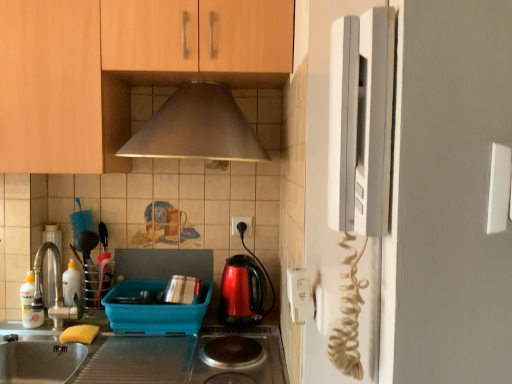
Where is `shiny plastic kettle at center`? The width and height of the screenshot is (512, 384). shiny plastic kettle at center is located at coordinates point(242,290).

This screenshot has height=384, width=512. Describe the element at coordinates (120, 69) in the screenshot. I see `wooden cabinet at upper center` at that location.

Identify the location of metallic silver exhaust hood at upper center. The image size is (512, 384). (197, 128).

Measure the distance between white plastic electric outlet at center, arranged as the first electric outlet when viewed from the left, and camera.

The distance of white plastic electric outlet at center, arranged as the first electric outlet when viewed from the left, from camera is 1.68 meters.

This screenshot has height=384, width=512. Find the location of `shiny plastic kettle at center`. shiny plastic kettle at center is located at coordinates (242, 290).

Considering the sizes of objects metallic utensil holder at left, acting as the 2th appliance starting from the right, and wooden cabinet at upper center in the image provided, who is smaller, metallic utensil holder at left, acting as the 2th appliance starting from the right, or wooden cabinet at upper center?

metallic utensil holder at left, acting as the 2th appliance starting from the right.

Can you confirm if metallic utensil holder at left, acting as the 2th appliance starting from the right, is positioned to the left of wooden cabinet at upper center?

Yes, metallic utensil holder at left, acting as the 2th appliance starting from the right, is to the left of wooden cabinet at upper center.

From the image's perspective, is metallic utensil holder at left, acting as the 2th appliance starting from the right, above or below wooden cabinet at upper center?

metallic utensil holder at left, acting as the 2th appliance starting from the right, is below wooden cabinet at upper center.

Who is shorter, metallic utensil holder at left, acting as the 2th appliance starting from the right, or wooden cabinet at upper center?

metallic utensil holder at left, acting as the 2th appliance starting from the right, is shorter.

In the image, is white plastic sink at left on the left side or the right side of yellow sponge at lower left?

In the image, white plastic sink at left appears on the left side of yellow sponge at lower left.

Between white plastic sink at left and yellow sponge at lower left, which one has larger size?

white plastic sink at left is bigger.

From a real-world perspective, who is located higher, white plastic sink at left or yellow sponge at lower left?

white plastic sink at left, from a real-world perspective.

Does white plastic sink at left have a greater height compared to yellow sponge at lower left?

Yes, white plastic sink at left is taller than yellow sponge at lower left.

In the scene shown: Is satin steel sink at lower left outside of white glossy bottle at sink left, acting as the 1th bottle starting from the front?

That's correct, satin steel sink at lower left is outside of white glossy bottle at sink left, acting as the 1th bottle starting from the front.

Consider the image. From the image's perspective, which is above, satin steel sink at lower left or white glossy bottle at sink left, which appears as the 2th bottle when viewed from the right?

white glossy bottle at sink left, which appears as the 2th bottle when viewed from the right, from the image's perspective.

Considering the positions of objects satin steel sink at lower left and white glossy bottle at sink left, which appears as the 2th bottle when viewed from the right, in the image provided, who is behind, satin steel sink at lower left or white glossy bottle at sink left, which appears as the 2th bottle when viewed from the right,?

white glossy bottle at sink left, which appears as the 2th bottle when viewed from the right, is further away from the camera.

Is shiny metallic stove at center inside the boundaries of white glossy bottle at sink left, which appears as the 2th bottle when viewed from the right, or outside?

shiny metallic stove at center is not inside white glossy bottle at sink left, which appears as the 2th bottle when viewed from the right, it's outside.

Could you tell me if shiny metallic stove at center is turned towards white glossy bottle at sink left, positioned as the second bottle in back-to-front order?

No, shiny metallic stove at center does not turn towards white glossy bottle at sink left, positioned as the second bottle in back-to-front order.

Considering the sizes of objects shiny metallic stove at center and white glossy bottle at sink left, which is the first bottle in left-to-right order, in the image provided, who is wider, shiny metallic stove at center or white glossy bottle at sink left, which is the first bottle in left-to-right order,?

shiny metallic stove at center.

Looking at this image, is the position of shiny metallic stove at center less distant than that of white glossy bottle at sink left, which is the first bottle in left-to-right order?

Yes.

From a real-world perspective, is yellow sponge at lower left above or below white glossy bottle at sink left, positioned as the second bottle in back-to-front order?

From a real-world perspective, yellow sponge at lower left is physically below white glossy bottle at sink left, positioned as the second bottle in back-to-front order.

Is point (61, 335) more distant than point (22, 308)?

No, it is in front of (22, 308).

Considering the relative positions of yellow sponge at lower left and white glossy bottle at sink left, which is the first bottle in left-to-right order, in the image provided, is yellow sponge at lower left to the right of white glossy bottle at sink left, which is the first bottle in left-to-right order, from the viewer's perspective?

Yes, yellow sponge at lower left is to the right of white glossy bottle at sink left, which is the first bottle in left-to-right order.

Which object is further away from the camera, yellow sponge at lower left or white glossy bottle at sink left, which is the first bottle in left-to-right order?

white glossy bottle at sink left, which is the first bottle in left-to-right order, is further from the camera.

In terms of width, does wooden cabinet at upper center look wider or thinner when compared to shiny plastic kettle at center?

wooden cabinet at upper center is wider than shiny plastic kettle at center.

From a real-world perspective, which object stands above the other?

wooden cabinet at upper center, from a real-world perspective.

Could you tell me if wooden cabinet at upper center is turned towards shiny plastic kettle at center?

No, wooden cabinet at upper center is not oriented towards shiny plastic kettle at center.

Between metallic silver exhaust hood at upper center and white glossy bottle at sink left, which is the second bottle from left to right, which one has smaller size?

With smaller size is white glossy bottle at sink left, which is the second bottle from left to right.

Does metallic silver exhaust hood at upper center appear on the right side of white glossy bottle at sink left, placed as the second bottle when sorted from front to back?

Indeed, metallic silver exhaust hood at upper center is positioned on the right side of white glossy bottle at sink left, placed as the second bottle when sorted from front to back.

From the image's perspective, would you say metallic silver exhaust hood at upper center is positioned over white glossy bottle at sink left, which ranks as the first bottle in back-to-front order?

Yes, from the image's perspective, metallic silver exhaust hood at upper center is over white glossy bottle at sink left, which ranks as the first bottle in back-to-front order.

In the scene shown: Does metallic silver exhaust hood at upper center touch white glossy bottle at sink left, placed as the second bottle when sorted from front to back?

No, metallic silver exhaust hood at upper center is not in contact with white glossy bottle at sink left, placed as the second bottle when sorted from front to back.

There is a metallic utensil holder at left, acting as the 2th appliance starting from the right. Where is `cabinetry above it (from a real-world perspective)`? The height and width of the screenshot is (384, 512). cabinetry above it (from a real-world perspective) is located at coordinates (120, 69).

This screenshot has width=512, height=384. Identify the location of home appliance that is in front of the yellow sponge at lower left. (39, 361).

Based on their spatial positions, is matte plastic dish rack at lower center, acting as the 1th appliance starting from the right, or yellow sponge at lower left closer to brushed metal faucet at left, positioned as the 1th appliance in left-to-right order?

yellow sponge at lower left lies closer to brushed metal faucet at left, positioned as the 1th appliance in left-to-right order, than the other object.

Which object lies further to the anchor point satin steel sink at lower left, wooden cabinet at upper center or shiny metallic stove at center?

wooden cabinet at upper center is positioned further to the anchor satin steel sink at lower left.

Considering their positions, is white plastic electrical outlet at right, the 2th electric outlet viewed from the left, positioned closer to shiny plastic kettle at center than white plastic electric outlet at center, which is the 1th electric outlet from back to front?

Among the two, white plastic electric outlet at center, which is the 1th electric outlet from back to front, is located nearer to shiny plastic kettle at center.

Considering their positions, is white plastic electric outlet at center, arranged as the first electric outlet when viewed from the left, positioned further to white plastic electrical outlet at right, acting as the second electric outlet starting from the back, than shiny metallic stove at center?

The object further to white plastic electrical outlet at right, acting as the second electric outlet starting from the back, is white plastic electric outlet at center, arranged as the first electric outlet when viewed from the left.

Based on their spatial positions, is matte plastic dish rack at lower center, acting as the 1th appliance starting from the right, or white plastic sink at left closer to shiny metallic stove at center?

Based on the image, matte plastic dish rack at lower center, acting as the 1th appliance starting from the right, appears to be nearer to shiny metallic stove at center.

Which object lies nearer to the anchor point white plastic electric outlet at center, which is the 1th electric outlet from back to front, metallic utensil holder at left, the 2th appliance in the left-to-right sequence, or shiny plastic kettle at center?

shiny plastic kettle at center.

Based on their spatial positions, is yellow sponge at lower left or white plastic electrical outlet at right, which ranks as the 1th electric outlet in front-to-back order, further from shiny metallic stove at center?

Based on the image, white plastic electrical outlet at right, which ranks as the 1th electric outlet in front-to-back order, appears to be further to shiny metallic stove at center.

Which object lies nearer to the anchor point wooden cabinet at upper center, shiny plastic kettle at center or white plastic electrical outlet at right, the 1th electric outlet when ordered from right to left?

Based on the image, shiny plastic kettle at center appears to be nearer to wooden cabinet at upper center.

Where is `appliance located between satin steel sink at lower left and metallic utensil holder at left, acting as the 2th appliance starting from the right, in the depth direction`? appliance located between satin steel sink at lower left and metallic utensil holder at left, acting as the 2th appliance starting from the right, in the depth direction is located at coordinates (154, 309).

At what (x,y) coordinates should I click in order to perform the action: click on bottle situated between brushed metal faucet at left, positioned as the 1th appliance in left-to-right order, and matte plastic dish rack at lower center, the 3th appliance positioned from the left, from left to right. Please return your answer as a coordinate pair (x, y). Looking at the image, I should click on (71, 283).

Locate an element on the screen. bottle between wooden cabinet at upper center and shiny plastic kettle at center in the up-down direction is located at coordinates (71, 283).

At what (x,y) coordinates should I click in order to perform the action: click on bottle situated between brushed metal faucet at left, positioned as the 1th appliance in left-to-right order, and white plastic electric outlet at center, which is counted as the 2th electric outlet, starting from the front, from left to right. Please return your answer as a coordinate pair (x, y). Image resolution: width=512 pixels, height=384 pixels. Looking at the image, I should click on (71, 283).